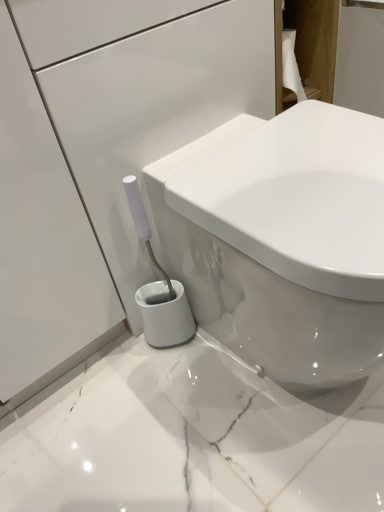
Question: Can you confirm if wooden cabinet at upper right is positioned to the right of white glossy toilet at center?

Choices:
 (A) yes
 (B) no

Answer: (A)

Question: Does wooden cabinet at upper right have a lesser height compared to white glossy toilet at center?

Choices:
 (A) yes
 (B) no

Answer: (A)

Question: From the image's perspective, would you say wooden cabinet at upper right is positioned over white glossy toilet at center?

Choices:
 (A) no
 (B) yes

Answer: (B)

Question: Is wooden cabinet at upper right in contact with white glossy toilet at center?

Choices:
 (A) no
 (B) yes

Answer: (A)

Question: Is wooden cabinet at upper right not close to white glossy toilet at center?

Choices:
 (A) yes
 (B) no

Answer: (B)

Question: Does wooden cabinet at upper right contain white glossy toilet at center?

Choices:
 (A) no
 (B) yes

Answer: (A)

Question: Does white glossy toilet at center contain wooden cabinet at upper right?

Choices:
 (A) yes
 (B) no

Answer: (B)

Question: Is white glossy toilet at center thinner than wooden cabinet at upper right?

Choices:
 (A) yes
 (B) no

Answer: (B)

Question: Does white glossy toilet at center have a smaller size compared to wooden cabinet at upper right?

Choices:
 (A) no
 (B) yes

Answer: (A)

Question: Does white glossy toilet at center have a lesser height compared to wooden cabinet at upper right?

Choices:
 (A) yes
 (B) no

Answer: (B)

Question: From a real-world perspective, is white glossy toilet at center located beneath wooden cabinet at upper right?

Choices:
 (A) no
 (B) yes

Answer: (B)

Question: Is white glossy toilet at center facing away from wooden cabinet at upper right?

Choices:
 (A) no
 (B) yes

Answer: (A)

Question: Considering their positions, is white glossy toilet at center located in front of or behind wooden cabinet at upper right?

Choices:
 (A) behind
 (B) front

Answer: (B)